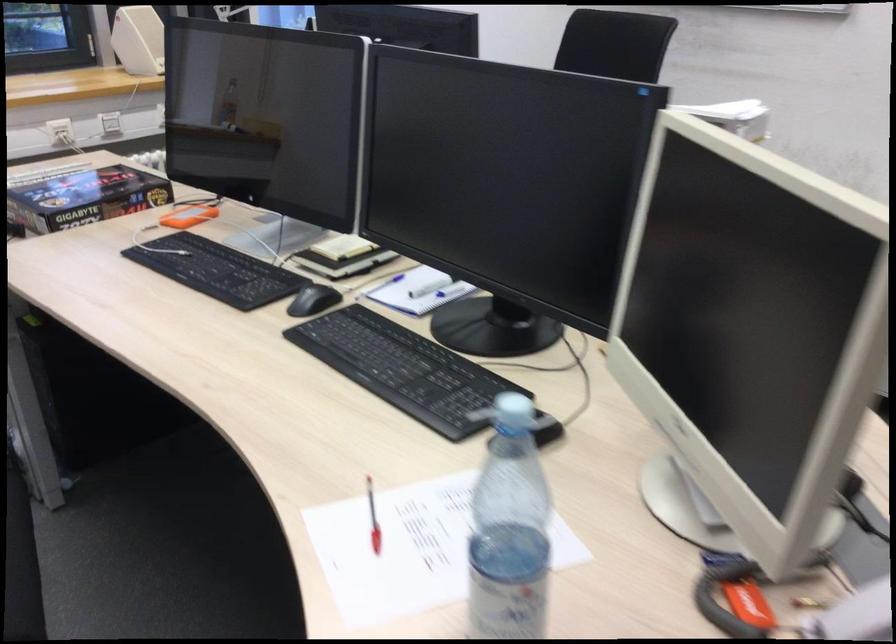
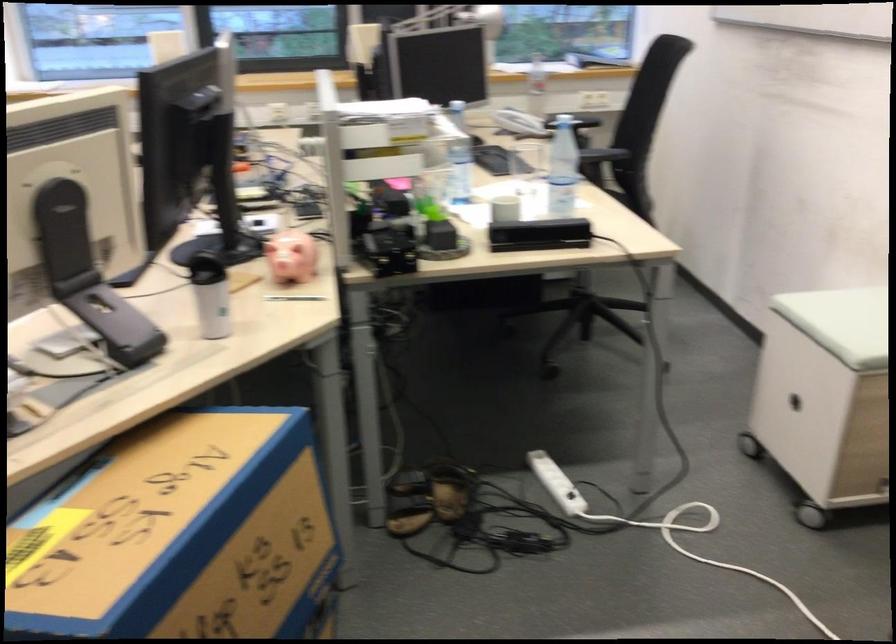
Question: I am providing you with two images of the same scene from different viewpoints. Which of the following objects are not visible in image2?

Choices:
 (A) stool handle hole
 (B) black computer mouse
 (C) black kinect sensor
 (D) beige computer speaker

Answer: (B)